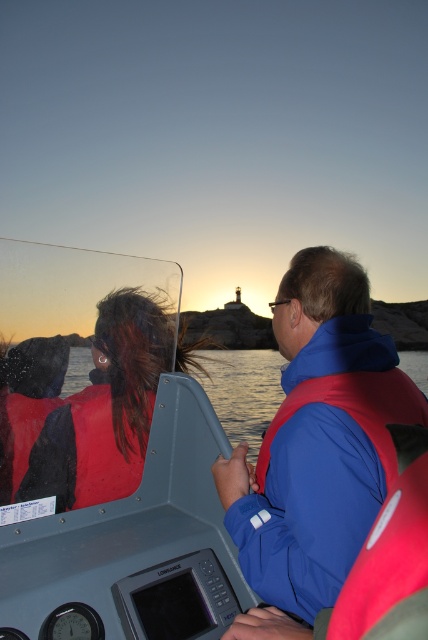
You are a passenger on the boat and need to retrieve an item that fell into the water. Which object is closer to you, the rubberized red life vest at center or the transparent water at center?

The rubberized red life vest at center is in front of the transparent water at center, so it is closer to you.

You are a passenger on the boat and want to know if the matte red life vest at left is floating on the transparent water at center. Based on the scene, can you determine if it is floating?

The matte red life vest at left is located above transparent water at center, which suggests it is floating on the water.